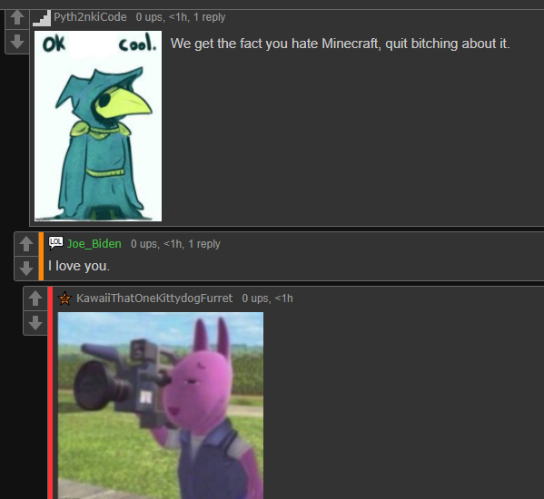
Find the location of a particular element. pictures is located at coordinates (114, 98), (133, 413).